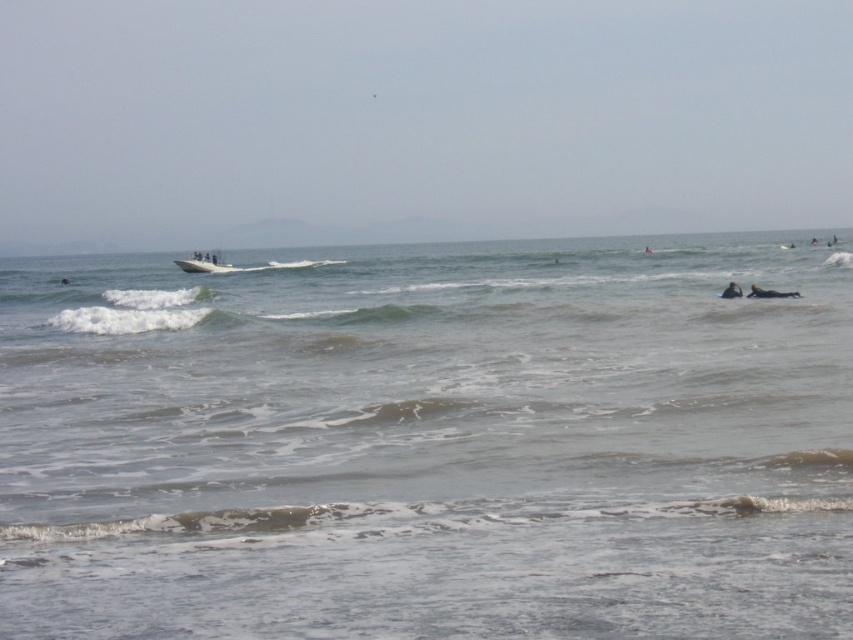
You are a photographer trying to capture the entire gray matte water at center and white plastic surfboard at center in one shot. Since your camera has a fixed frame, you need to adjust your position to fit both objects. Which object should you focus on to ensure both are fully visible?

Since the gray matte water at center is larger in size than the white plastic surfboard at center, you should focus on the gray matte water at center to ensure both objects are fully visible within the frame.

You are a photographer trying to capture the black rubber surfboard at lower right and the gray matte water at center in the same frame. Which object will appear taller in the photo?

The gray matte water at center will appear taller in the photo because it has a greater height compared to the black rubber surfboard at lower right.

You are standing at the origin point of the coordinate system in this coastal scene. There are two points marked in the image. Which point is closer to you, point (x=184, y=268) or point (x=740, y=294)?

Point (x=740, y=294) is closer to you because it is in front of point (x=184, y=268).